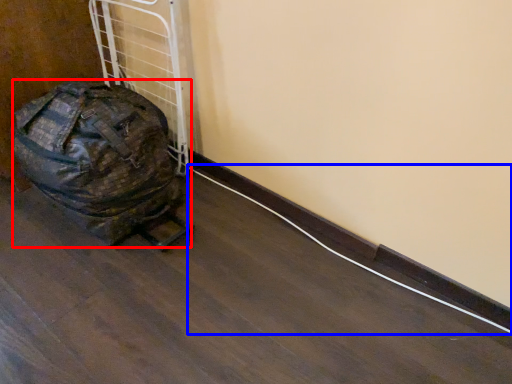
Question: Among these objects, which one is nearest to the camera, luggage and bags (highlighted by a red box) or wire (highlighted by a blue box)?

Choices:
 (A) luggage and bags
 (B) wire

Answer: (A)